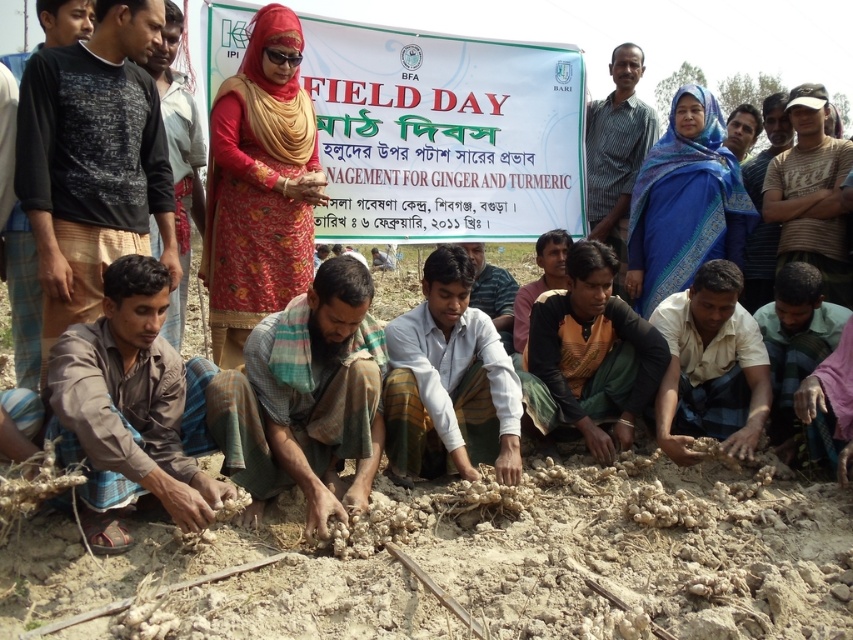
You are a photographer standing in the middle of the scene. You want to take a photo that includes both the white paper banner at center and the white cotton shirt at center. Which object will appear larger in the photo?

The white paper banner at center will appear larger in the photo because it is much taller than the white cotton shirt at center.

You are a photographer at the event and want to capture a photo that includes both the white paper banner at center and the brown plaid shirt at lower left. Since the banner is larger, will it block the view of the shirt in the photo?

The white paper banner at center is larger in size than the brown plaid shirt at lower left, so it might block the view of the shirt depending on their positions. To ensure both are visible, position the camera so the banner is partially visible behind or beside the shirt without covering it completely.

From the picture: You are a photographer trying to capture a clear shot of the white cotton shirt at center. However, the white paper banner at center is blocking your view. Can you determine if the banner is in front of or behind the shirt?

The white paper banner at center is positioned over the white cotton shirt at center, meaning it is in front of the shirt, so the banner is blocking the view of the shirt.